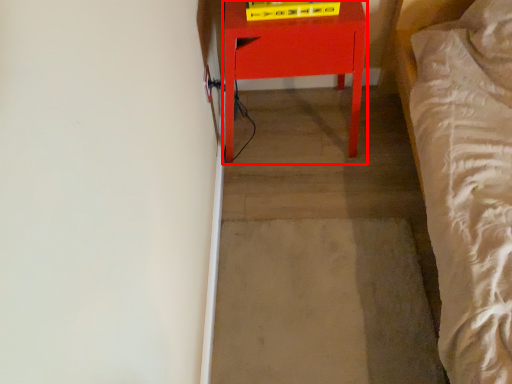
Question: From the image, what is the correct spatial relationship of furniture (annotated by the red box) in relation to concrete?

Choices:
 (A) left
 (B) right

Answer: (A)